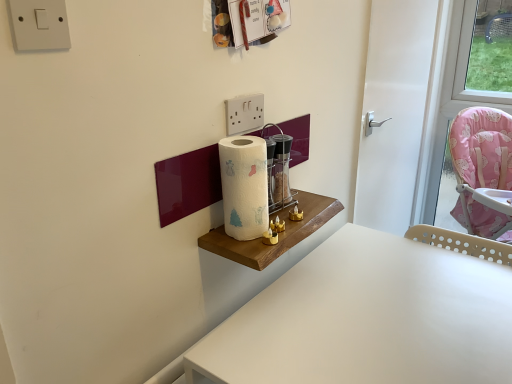
Question: From a real-world perspective, does white paper towel at center sit lower than white plastic table at lower right?

Choices:
 (A) no
 (B) yes

Answer: (A)

Question: Could white plastic table at lower right be considered to be inside white paper towel at center?

Choices:
 (A) no
 (B) yes

Answer: (A)

Question: Is white paper towel at center positioned in front of white plastic table at lower right?

Choices:
 (A) no
 (B) yes

Answer: (A)

Question: Is white paper towel at center oriented towards white plastic table at lower right?

Choices:
 (A) no
 (B) yes

Answer: (A)

Question: Does white paper towel at center have a lesser height compared to white plastic table at lower right?

Choices:
 (A) no
 (B) yes

Answer: (B)

Question: Is white plastic table at lower right at the back of white paper towel at center?

Choices:
 (A) yes
 (B) no

Answer: (B)

Question: Does white glossy door at center turn towards white plastic table at lower right?

Choices:
 (A) yes
 (B) no

Answer: (B)

Question: From a real-world perspective, is white glossy door at center beneath white plastic table at lower right?

Choices:
 (A) yes
 (B) no

Answer: (B)

Question: Is white glossy door at center directly adjacent to white plastic table at lower right?

Choices:
 (A) yes
 (B) no

Answer: (B)

Question: From the image's perspective, would you say white glossy door at center is shown under white plastic table at lower right?

Choices:
 (A) no
 (B) yes

Answer: (A)

Question: Considering the relative sizes of white glossy door at center and white plastic table at lower right in the image provided, is white glossy door at center shorter than white plastic table at lower right?

Choices:
 (A) yes
 (B) no

Answer: (B)

Question: Is white glossy door at center smaller than white plastic table at lower right?

Choices:
 (A) no
 (B) yes

Answer: (B)

Question: Is transparent glass wine bottle at center further to camera compared to white glossy door at center?

Choices:
 (A) no
 (B) yes

Answer: (A)